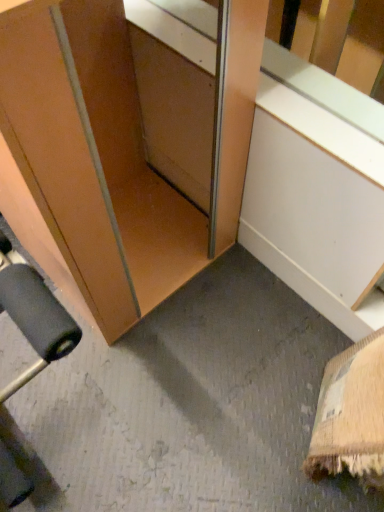
Question: Is matte wood cabinet at lower left bigger or smaller than wooden at lower left?

Choices:
 (A) small
 (B) big

Answer: (B)

Question: Is point (56, 128) positioned closer to the camera than point (201, 19)?

Choices:
 (A) farther
 (B) closer

Answer: (B)

Question: In terms of height, does matte wood cabinet at lower left look taller or shorter compared to wooden at lower left?

Choices:
 (A) tall
 (B) short

Answer: (A)

Question: Considering the positions of wooden at lower left and matte wood cabinet at lower left in the image, is wooden at lower left bigger or smaller than matte wood cabinet at lower left?

Choices:
 (A) big
 (B) small

Answer: (B)

Question: In terms of width, does wooden at lower left look wider or thinner when compared to matte wood cabinet at lower left?

Choices:
 (A) thin
 (B) wide

Answer: (A)

Question: From the image's perspective, is wooden at lower left above or below matte wood cabinet at lower left?

Choices:
 (A) below
 (B) above

Answer: (A)

Question: Based on their positions, is wooden at lower left located to the left or right of matte wood cabinet at lower left?

Choices:
 (A) right
 (B) left

Answer: (A)